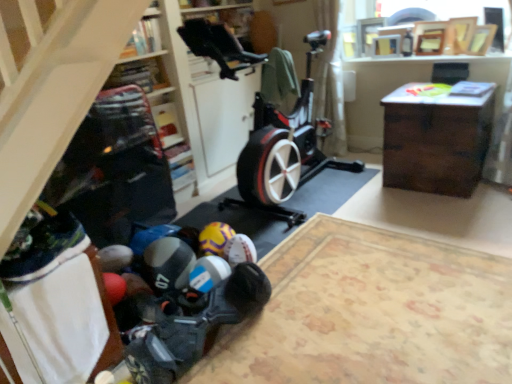
Image resolution: width=512 pixels, height=384 pixels. I want to click on vacant space that's between dark wood desk at right and yellow matte soccer ball at lower center, the 1th toy when ordered from back to front, so click(353, 212).